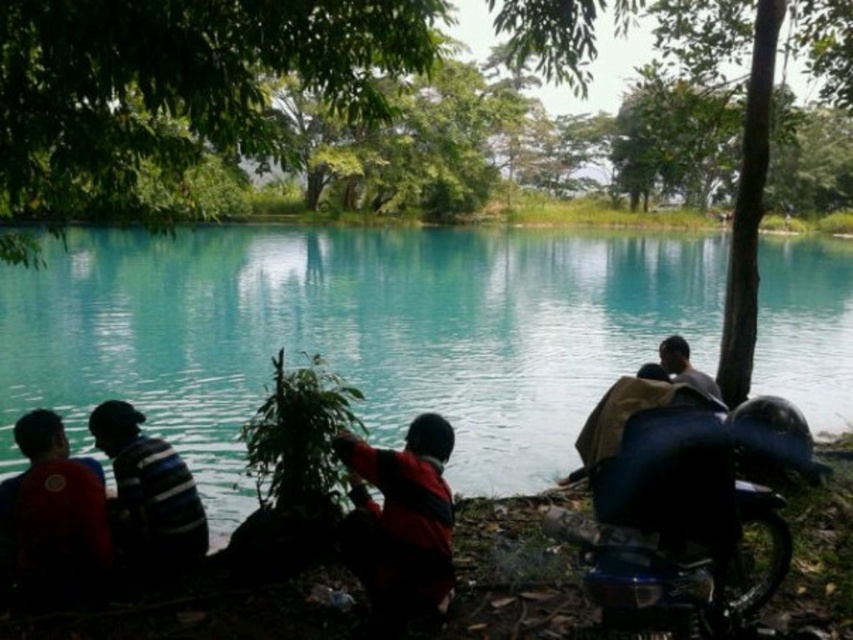
Question: Is matte red shirt at lower left to the left of striped fabric shirt at left from the viewer's perspective?

Choices:
 (A) yes
 (B) no

Answer: (A)

Question: Where is shiny black motorcycle at lower right located in relation to striped fabric shirt at left in the image?

Choices:
 (A) right
 (B) left

Answer: (A)

Question: Among these objects, which one is nearest to the camera?

Choices:
 (A) striped fabric shirt at left
 (B) green leafy tree at center
 (C) matte red shirt at lower left
 (D) matte black helmet at right

Answer: (B)

Question: Is green leafy tree at center below matte red shirt at lower left?

Choices:
 (A) no
 (B) yes

Answer: (A)

Question: Which is farther from the matte black helmet at right?

Choices:
 (A) green leafy tree at center
 (B) matte red shirt at lower left

Answer: (A)

Question: Among these objects, which one is nearest to the camera?

Choices:
 (A) red matte jacket at center
 (B) striped fabric shirt at left
 (C) matte red shirt at lower left
 (D) green leafy tree at center

Answer: (D)